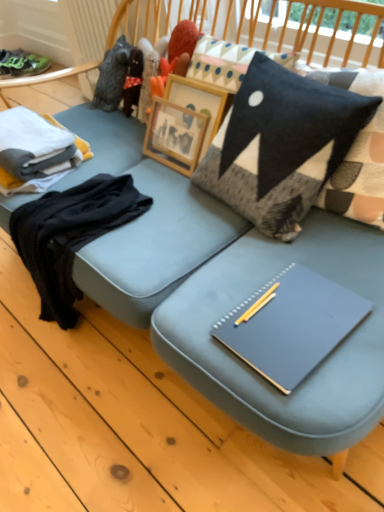
Question: Does black felt pillow at upper right appear on the right side of green suede sneakers at upper left?

Choices:
 (A) yes
 (B) no

Answer: (A)

Question: From the image's perspective, would you say black felt pillow at upper right is positioned over green suede sneakers at upper left?

Choices:
 (A) yes
 (B) no

Answer: (B)

Question: Is black felt pillow at upper right smaller than green suede sneakers at upper left?

Choices:
 (A) yes
 (B) no

Answer: (B)

Question: Could you tell me if black felt pillow at upper right is facing green suede sneakers at upper left?

Choices:
 (A) no
 (B) yes

Answer: (A)

Question: Considering the relative sizes of black felt pillow at upper right and green suede sneakers at upper left in the image provided, is black felt pillow at upper right bigger than green suede sneakers at upper left?

Choices:
 (A) no
 (B) yes

Answer: (B)

Question: Is black felt pillow at upper right at the left side of green suede sneakers at upper left?

Choices:
 (A) yes
 (B) no

Answer: (B)

Question: Is matte gray notebook at center oriented away from white cotton folded clothes at left, which ranks as the 1th clothing in top-to-bottom order?

Choices:
 (A) yes
 (B) no

Answer: (B)

Question: From the image's perspective, would you say matte gray notebook at center is shown under white cotton folded clothes at left, which ranks as the 1th clothing in top-to-bottom order?

Choices:
 (A) no
 (B) yes

Answer: (B)

Question: From the image's perspective, would you say matte gray notebook at center is positioned over white cotton folded clothes at left, which ranks as the 1th clothing in top-to-bottom order?

Choices:
 (A) no
 (B) yes

Answer: (A)

Question: Considering the relative sizes of matte gray notebook at center and white cotton folded clothes at left, which ranks as the second clothing in bottom-to-top order, in the image provided, is matte gray notebook at center thinner than white cotton folded clothes at left, which ranks as the second clothing in bottom-to-top order,?

Choices:
 (A) no
 (B) yes

Answer: (A)

Question: Is matte gray notebook at center located outside white cotton folded clothes at left, which ranks as the 1th clothing in top-to-bottom order?

Choices:
 (A) no
 (B) yes

Answer: (B)

Question: Does matte gray notebook at center have a greater width compared to white cotton folded clothes at left, which ranks as the second clothing in bottom-to-top order?

Choices:
 (A) no
 (B) yes

Answer: (B)

Question: Is matte gray notebook at center not inside black cotton sweater at left, which is the 2th clothing from top to bottom?

Choices:
 (A) yes
 (B) no

Answer: (A)